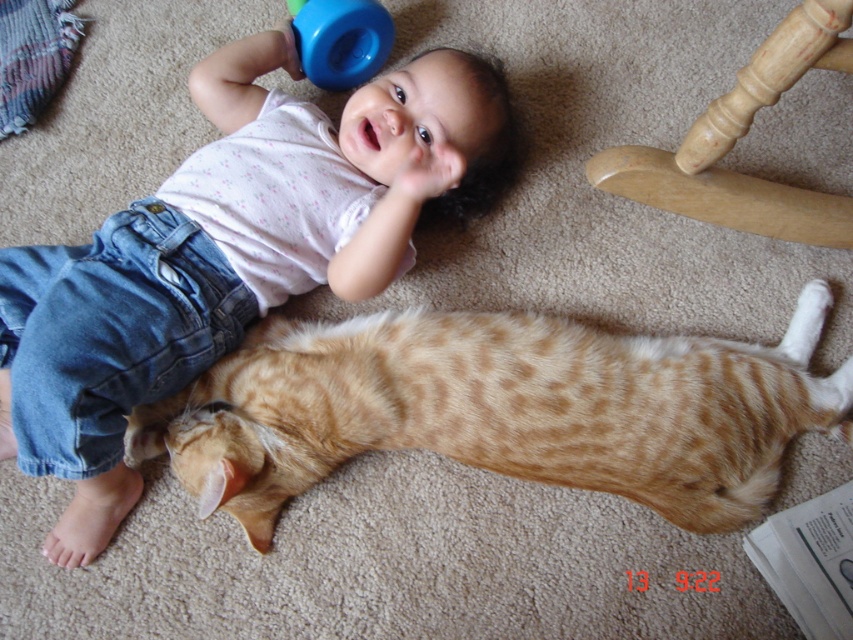
Can you confirm if orange tabby cat at lower center is positioned below blue rubber sippy cup at upper center?

Indeed, orange tabby cat at lower center is positioned under blue rubber sippy cup at upper center.

You are a GUI agent. You are given a task and a screenshot of the screen. Output one action in this format:
    pyautogui.click(x=<x>, y=<y>)
    Task: Click on the orange tabby cat at lower center
    
    Given the screenshot: What is the action you would take?
    pyautogui.click(x=498, y=410)

Describe the element at coordinates (498, 410) in the screenshot. Image resolution: width=853 pixels, height=640 pixels. I see `orange tabby cat at lower center` at that location.

I want to click on orange tabby cat at lower center, so click(x=498, y=410).

Between matte white shirt at upper center and blue rubber sippy cup at upper center, which one is positioned lower?

matte white shirt at upper center

Does point (57, 394) lie in front of point (329, 88)?

Yes, it is in front of point (329, 88).

The image size is (853, 640). I want to click on matte white shirt at upper center, so click(223, 256).

The image size is (853, 640). In order to click on matte white shirt at upper center in this screenshot , I will do `click(223, 256)`.

Consider the image. Can you confirm if matte white shirt at upper center is smaller than orange tabby cat at lower center?

Actually, matte white shirt at upper center might be larger than orange tabby cat at lower center.

Who is more distant from viewer, (199, 323) or (561, 337)?

The point (199, 323) is more distant.

Identify the location of matte white shirt at upper center. This screenshot has height=640, width=853. (223, 256).